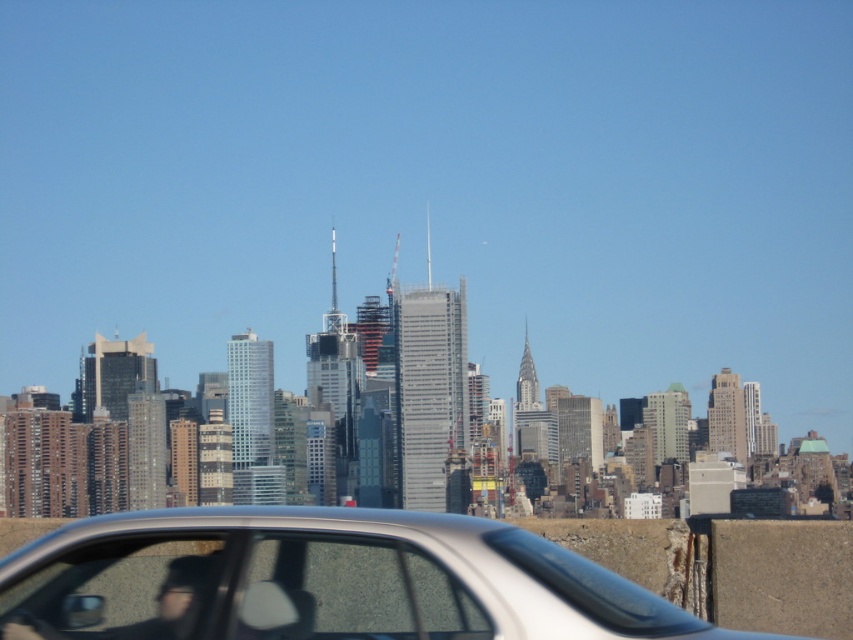
Question: Is silver metallic car at center to the left of transparent glass car window at center from the viewer's perspective?

Choices:
 (A) yes
 (B) no

Answer: (B)

Question: Among these objects, which one is farthest from the camera?

Choices:
 (A) transparent glass car window at center
 (B) silver metallic car at center
 (C) transparent glass car window at lower left

Answer: (C)

Question: Does transparent glass car window at center appear on the left side of transparent glass car window at lower left?

Choices:
 (A) no
 (B) yes

Answer: (A)

Question: Which object is the closest to the transparent glass car window at center?

Choices:
 (A) silver metallic car at center
 (B) transparent glass car window at lower left

Answer: (A)

Question: Which of the following is the closest to the observer?

Choices:
 (A) (335, 612)
 (B) (184, 540)
 (C) (16, 609)

Answer: (A)

Question: Can you confirm if silver metallic car at center is bigger than transparent glass car window at center?

Choices:
 (A) yes
 (B) no

Answer: (A)